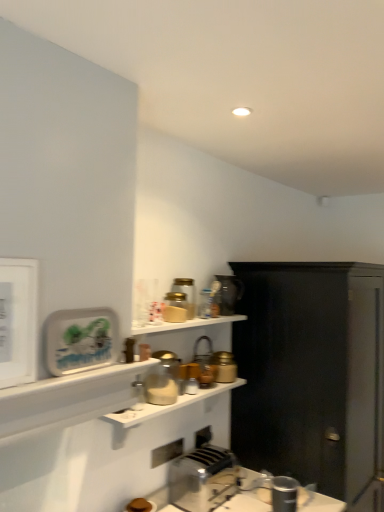
Question: Considering the relative sizes of black matte cabinet at right and translucent glass jar at upper center, which is the 4th appliance in back-to-front order, in the image provided, is black matte cabinet at right smaller than translucent glass jar at upper center, which is the 4th appliance in back-to-front order,?

Choices:
 (A) no
 (B) yes

Answer: (A)

Question: Does black matte cabinet at right have a larger size compared to translucent glass jar at upper center, which is the 4th appliance in back-to-front order?

Choices:
 (A) no
 (B) yes

Answer: (B)

Question: Is black matte cabinet at right beside translucent glass jar at upper center, which is the 6th appliance in bottom-to-top order?

Choices:
 (A) no
 (B) yes

Answer: (A)

Question: Can you confirm if black matte cabinet at right is taller than translucent glass jar at upper center, placed as the fourth appliance when sorted from front to back?

Choices:
 (A) no
 (B) yes

Answer: (B)

Question: Does black matte cabinet at right lie in front of translucent glass jar at upper center, which is the 6th appliance in bottom-to-top order?

Choices:
 (A) yes
 (B) no

Answer: (A)

Question: Is black matte cabinet at right inside the boundaries of metallic faucet at upper center, the 3th appliance in the bottom-to-top sequence, or outside?

Choices:
 (A) inside
 (B) outside

Answer: (B)

Question: Is black matte cabinet at right taller or shorter than metallic faucet at upper center, marked as the 5th appliance in a top-to-bottom arrangement?

Choices:
 (A) tall
 (B) short

Answer: (A)

Question: Is black matte cabinet at right wider or thinner than metallic faucet at upper center, marked as the 5th appliance in a top-to-bottom arrangement?

Choices:
 (A) thin
 (B) wide

Answer: (B)

Question: From the image's perspective, is black matte cabinet at right above or below metallic faucet at upper center, the 5th appliance positioned from the front?

Choices:
 (A) above
 (B) below

Answer: (B)

Question: In terms of width, does metallic silver toaster at upper center, which is the 7th appliance in bottom-to-top order, look wider or thinner when compared to metallic silver toaster at lower center, marked as the 6th appliance in a back-to-front arrangement?

Choices:
 (A) wide
 (B) thin

Answer: (A)

Question: In the image, is metallic silver toaster at upper center, which is the 7th appliance in bottom-to-top order, positioned in front of or behind metallic silver toaster at lower center, which is the 2th appliance in front-to-back order?

Choices:
 (A) behind
 (B) front

Answer: (A)

Question: Is point (221, 305) positioned closer to the camera than point (274, 479)?

Choices:
 (A) farther
 (B) closer

Answer: (A)

Question: Is metallic silver toaster at upper center, which is the 7th appliance in bottom-to-top order, to the left or to the right of metallic silver toaster at lower center, acting as the first appliance starting from the bottom, in the image?

Choices:
 (A) left
 (B) right

Answer: (A)

Question: Based on their positions, is metallic faucet at upper center, the 3th appliance in the bottom-to-top sequence, located to the left or right of metallic silver toaster at upper center, placed as the first appliance when sorted from top to bottom?

Choices:
 (A) left
 (B) right

Answer: (A)

Question: From a real-world perspective, is metallic faucet at upper center, marked as the 5th appliance in a top-to-bottom arrangement, positioned above or below metallic silver toaster at upper center, the seventh appliance in the front-to-back sequence?

Choices:
 (A) below
 (B) above

Answer: (A)